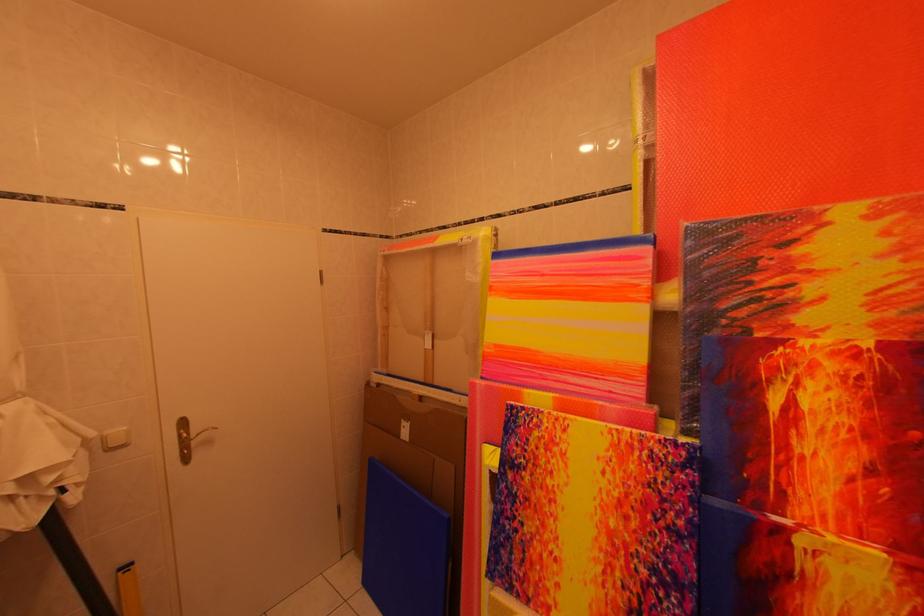
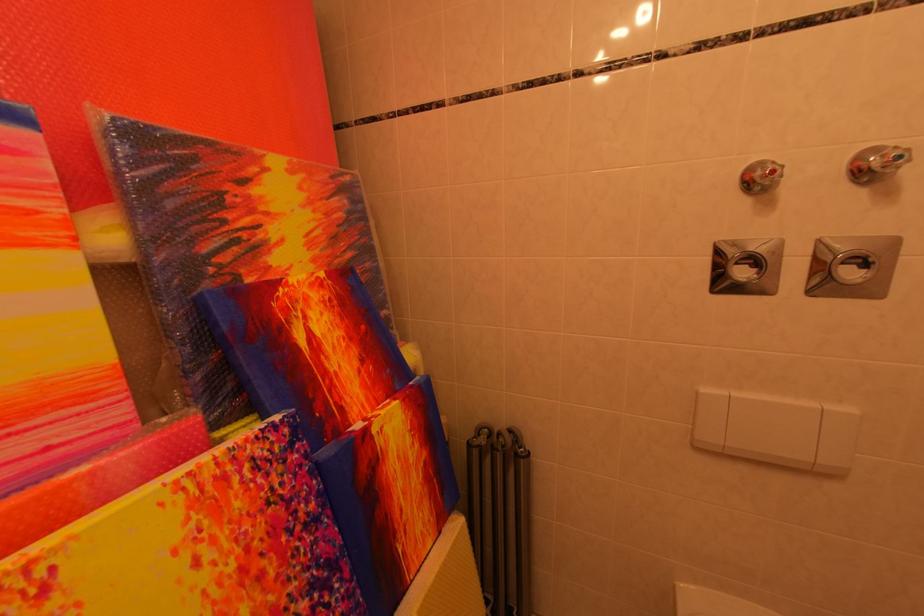
The point at [700,488] is marked in the first image. Where is the corresponding point in the second image?

(313, 460)